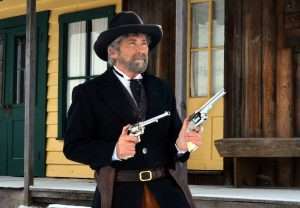
This screenshot has height=208, width=300. I want to click on door, so click(x=11, y=121).